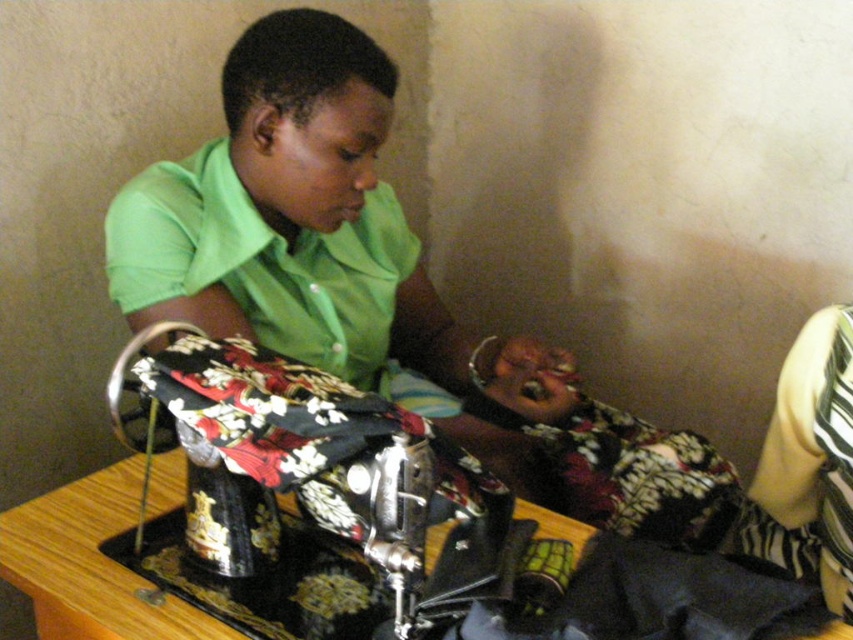
Question: Is floral cotton fabric at center smaller than yellow striped fabric at right?

Choices:
 (A) yes
 (B) no

Answer: (B)

Question: Among these objects, which one is farthest from the camera?

Choices:
 (A) green matte shirt at center
 (B) yellow striped fabric at right

Answer: (B)

Question: Which is farther from the floral cotton fabric at center?

Choices:
 (A) yellow striped fabric at right
 (B) black fabric-covered sewing machine at center

Answer: (A)

Question: Does black fabric-covered sewing machine at center lie in front of floral cotton fabric at center?

Choices:
 (A) no
 (B) yes

Answer: (B)

Question: Can you confirm if green matte shirt at center is thinner than black fabric-covered sewing machine at center?

Choices:
 (A) yes
 (B) no

Answer: (B)

Question: Among these points, which one is nearest to the camera?

Choices:
 (A) (816, 477)
 (B) (248, 310)

Answer: (B)